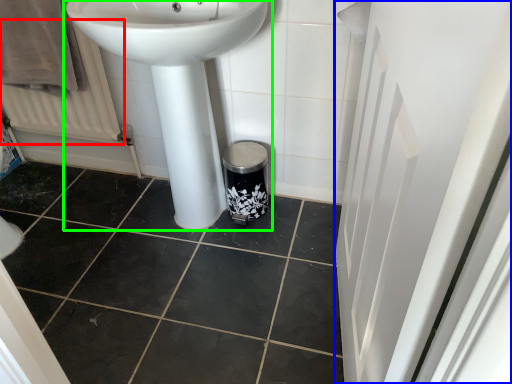
Question: Considering the real-world distances, which object is farthest from radiator (highlighted by a red box)? screen door (highlighted by a blue box) or sink (highlighted by a green box)?

Choices:
 (A) screen door
 (B) sink

Answer: (A)